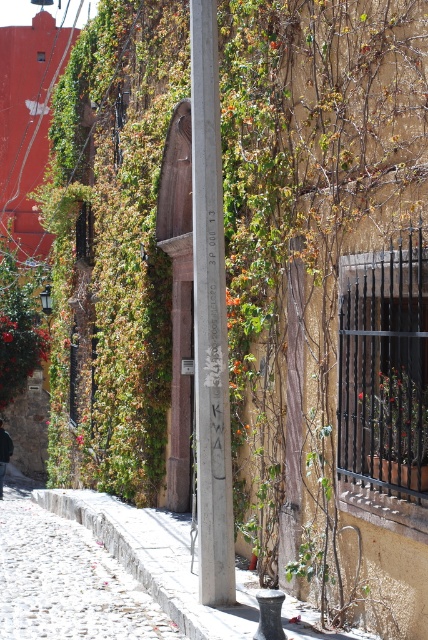
Question: Can you confirm if white cobblestone at lower left is positioned to the right of green leafy plant at center?

Choices:
 (A) yes
 (B) no

Answer: (B)

Question: Can you confirm if smooth gray pole at center is positioned above green leafy plant at center?

Choices:
 (A) no
 (B) yes

Answer: (B)

Question: Which of the following is the closest to the observer?

Choices:
 (A) (403, 380)
 (B) (44, 589)

Answer: (A)

Question: Which point is closer to the camera?

Choices:
 (A) (418, 432)
 (B) (222, 563)

Answer: (A)

Question: From the image, what is the correct spatial relationship of smooth gray pole at center in relation to white cobblestone at lower left?

Choices:
 (A) above
 (B) below

Answer: (A)

Question: Which point appears closest to the camera in this image?

Choices:
 (A) (26, 532)
 (B) (220, 189)
 (C) (416, 387)

Answer: (C)